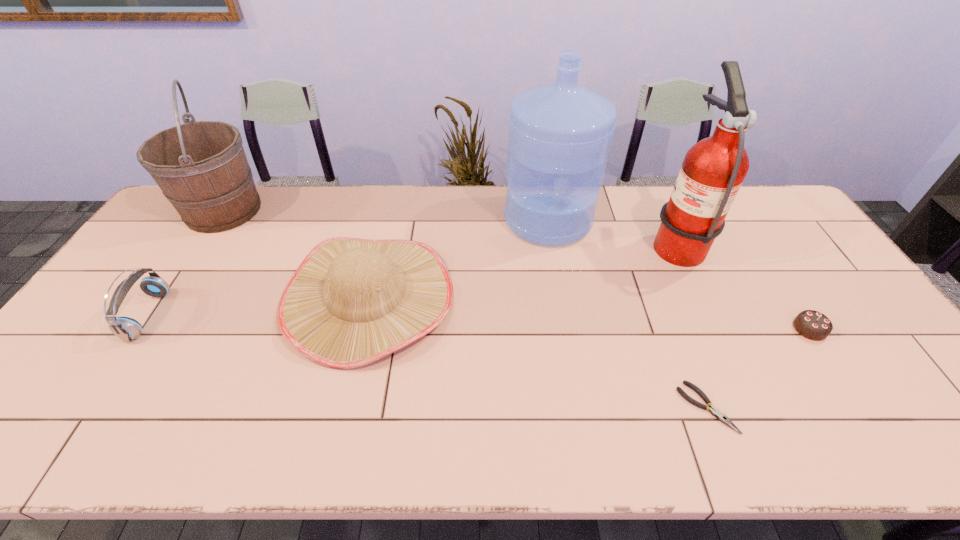
Identify the location of free point between the fire extinguisher and the third tallest object. Image resolution: width=960 pixels, height=540 pixels. (449, 226).

The height and width of the screenshot is (540, 960). I want to click on vacant point located between the fifth object from right to left and the shortest object, so click(x=538, y=352).

Where is `vacant point located between the third tallest object and the water jug`? Image resolution: width=960 pixels, height=540 pixels. vacant point located between the third tallest object and the water jug is located at coordinates (386, 215).

Locate an element on the screen. The width and height of the screenshot is (960, 540). vacant area between the water jug and the third tallest object is located at coordinates (386, 215).

This screenshot has width=960, height=540. In order to click on vacant region between the fire extinguisher and the nearest object in this screenshot , I will do `click(691, 325)`.

Identify the location of empty space between the second shortest object and the water jug. (679, 274).

You are a GUI agent. You are given a task and a screenshot of the screen. Output one action in this format:
    pyautogui.click(x=<x>, y=<y>)
    Task: Click on the unoccupied position between the fourth tallest object and the headset
    This screenshot has height=540, width=960.
    Given the screenshot: What is the action you would take?
    [x=258, y=306]

Locate an element on the screen. free space between the fourth object from left to right and the fire extinguisher is located at coordinates (612, 231).

Locate an element on the screen. free space between the nearest object and the chocolate cake is located at coordinates (757, 368).

Where is `object that stands as the sixth closest to the fire extinguisher`? The width and height of the screenshot is (960, 540). object that stands as the sixth closest to the fire extinguisher is located at coordinates (127, 329).